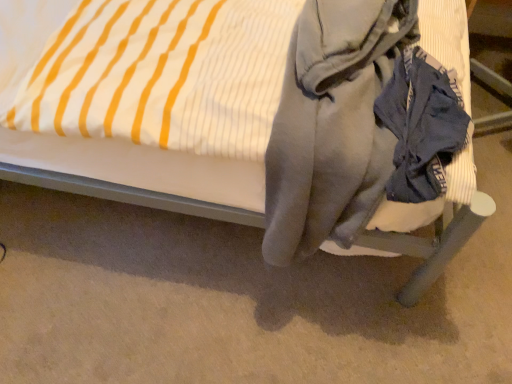
Image resolution: width=512 pixels, height=384 pixels. What do you see at coordinates (332, 125) in the screenshot?
I see `gray fleece hoodie at lower right` at bounding box center [332, 125].

At what (x,y) coordinates should I click in order to perform the action: click on gray fleece hoodie at lower right. Please return your answer as a coordinate pair (x, y). Looking at the image, I should click on (332, 125).

Looking at this image, what is the approximate width of gray fleece hoodie at lower right?

23.69 inches.

Find the location of `gray fleece hoodie at lower right`. gray fleece hoodie at lower right is located at coordinates [x=332, y=125].